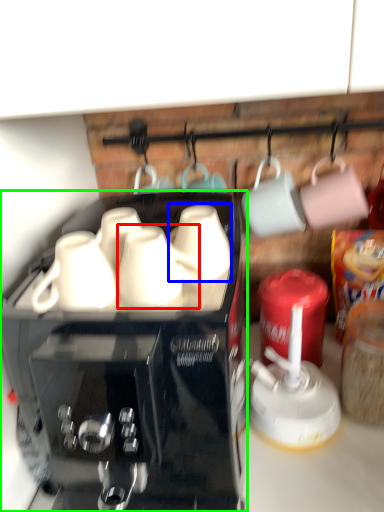
Question: Which object is the closest to the mug (highlighted by a red box)? Choose among these: mug (highlighted by a blue box) or coffee maker (highlighted by a green box).

Choices:
 (A) mug
 (B) coffee maker

Answer: (A)